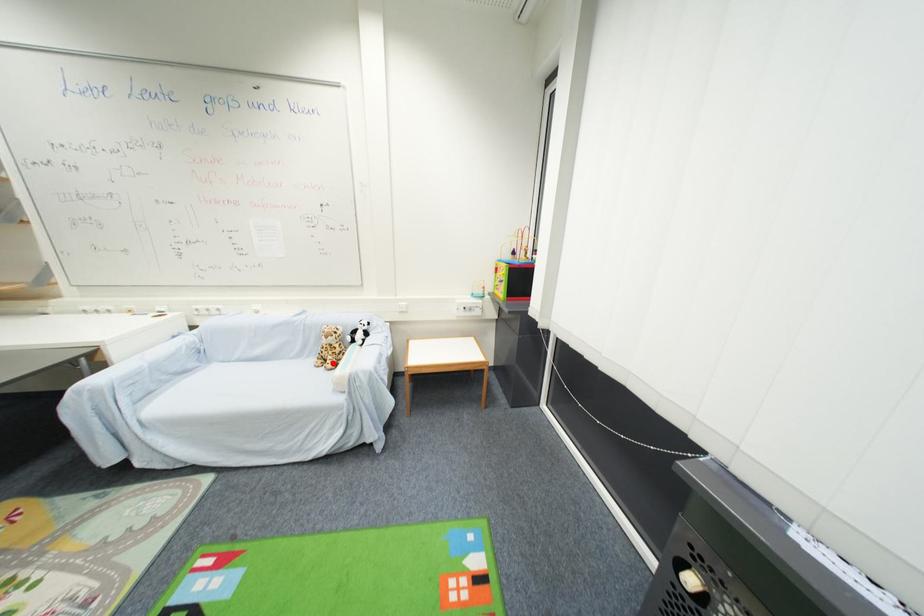
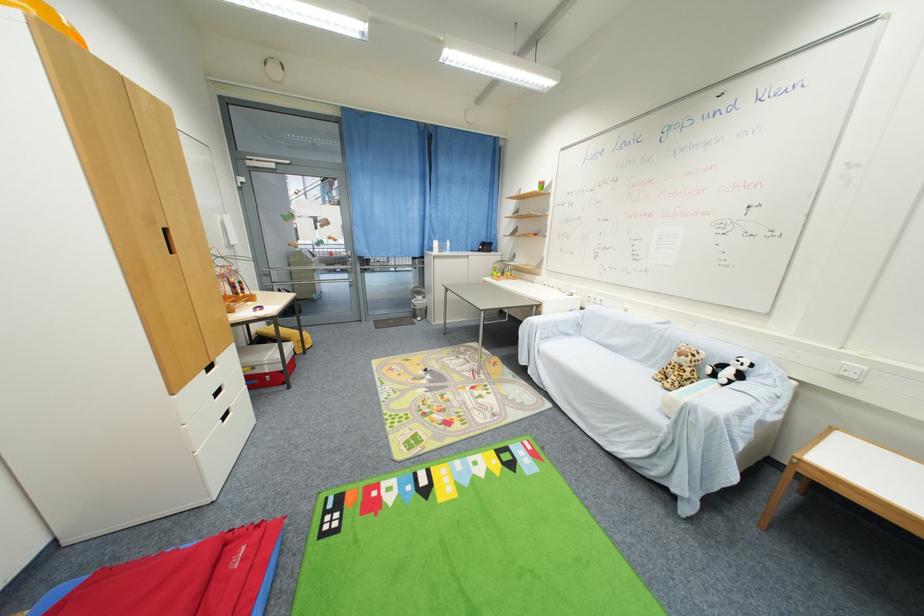
Locate, in the second image, the point that corresponds to the highlighted location in the first image.

(675, 382)